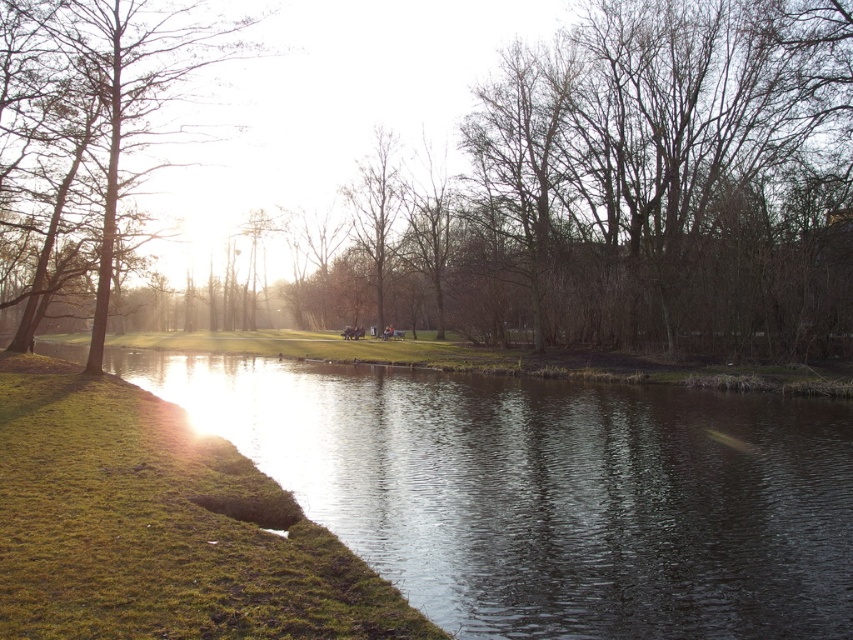
The width and height of the screenshot is (853, 640). What do you see at coordinates (621, 192) in the screenshot? I see `brown leafless tree at left` at bounding box center [621, 192].

Is the position of brown leafless tree at left more distant than that of green grassy river at lower left?

Yes, it is.

The width and height of the screenshot is (853, 640). Describe the element at coordinates (621, 192) in the screenshot. I see `brown leafless tree at left` at that location.

Where is `brown leafless tree at left`? The image size is (853, 640). brown leafless tree at left is located at coordinates [621, 192].

Does brown leafless tree at left have a smaller size compared to brown textured tree at upper left?

Incorrect, brown leafless tree at left is not smaller in size than brown textured tree at upper left.

Does brown leafless tree at left appear over brown textured tree at upper left?

Yes.

Which is in front, point (838, 83) or point (100, 355)?

Point (100, 355) is more forward.

Identify the location of brown leafless tree at left. This screenshot has width=853, height=640. (621, 192).

Who is positioned more to the right, green grassy river at lower left or brown textured tree at upper left?

Positioned to the right is green grassy river at lower left.

Is green grassy river at lower left wider than brown textured tree at upper left?

Correct, the width of green grassy river at lower left exceeds that of brown textured tree at upper left.

Is point (838, 417) positioned before point (117, 19)?

Yes, it is.

At what (x,y) coordinates should I click in order to perform the action: click on green grassy river at lower left. Please return your answer as a coordinate pair (x, y). Looking at the image, I should click on (550, 492).